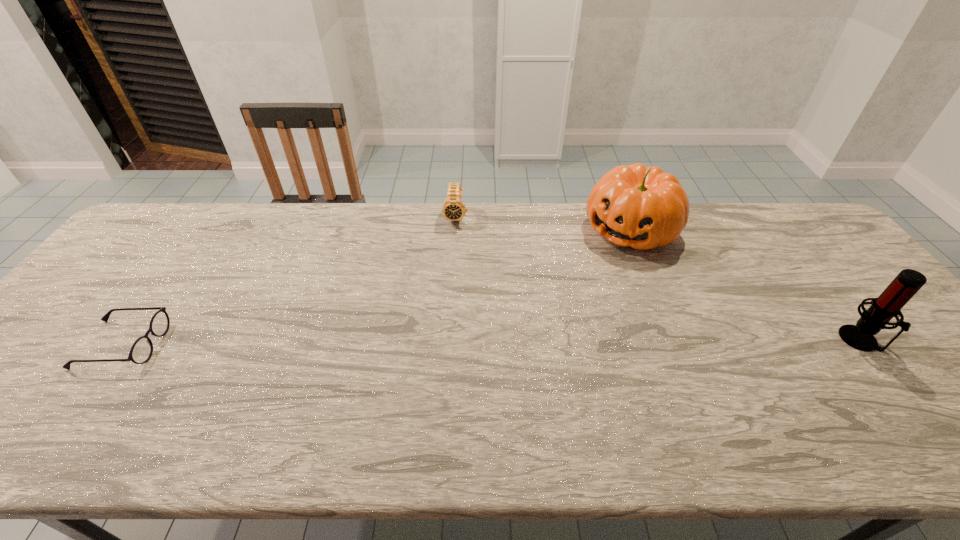
Where is `vacant space at the left edge`? vacant space at the left edge is located at coordinates (43, 339).

Locate an element on the screen. vacant space at the right edge is located at coordinates (913, 367).

At what (x,y) coordinates should I click in order to perform the action: click on vacant point located between the rightmost object and the pumpkin. Please return your answer as a coordinate pair (x, y). Image resolution: width=960 pixels, height=540 pixels. Looking at the image, I should click on (745, 285).

Find the location of a particular element. vacant area that lies between the shortest object and the third tallest object is located at coordinates (289, 281).

Identify the location of vacant area that lies between the spectacles and the microphone. This screenshot has height=540, width=960. (491, 342).

Where is `free space between the third tallest object and the pumpkin`? This screenshot has width=960, height=540. free space between the third tallest object and the pumpkin is located at coordinates (543, 223).

Find the location of a particular element. vacant area that lies between the pumpkin and the rightmost object is located at coordinates (745, 285).

Identify the location of free space between the shortest object and the third tallest object. pos(289,281).

Where is `free space between the rightmost object and the leftmost object`? free space between the rightmost object and the leftmost object is located at coordinates pyautogui.click(x=491, y=342).

Locate an element on the screen. free area in between the rightmost object and the leftmost object is located at coordinates (491, 342).